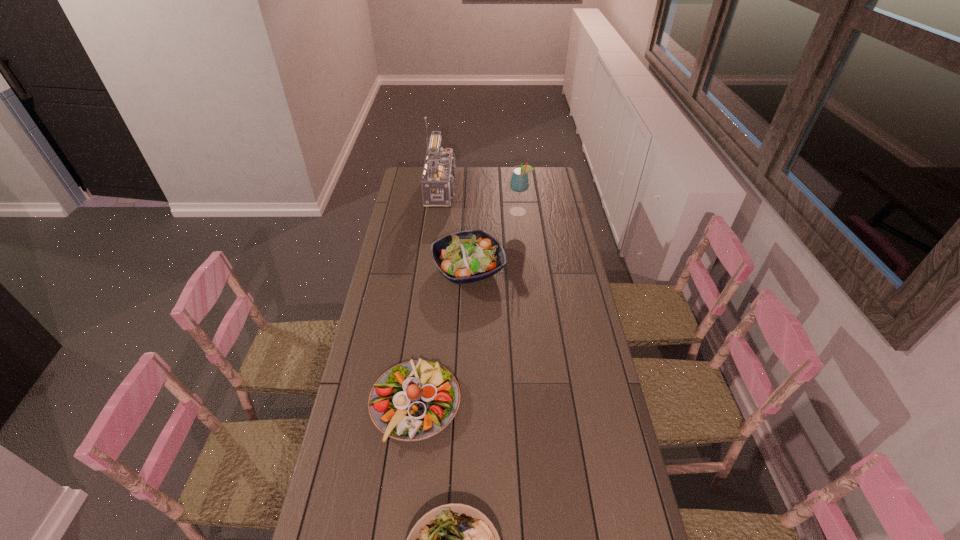
The width and height of the screenshot is (960, 540). In order to click on free spot that satisfies the following two spatial constraints: 1. on the front-facing side of the radio receiver; 2. on the left side of the fourth shortest object in this screenshot , I will do `click(444, 212)`.

Find the location of a particular element. This screenshot has width=960, height=540. blank area in the image that satisfies the following two spatial constraints: 1. on the back side of the second nearest object; 2. on the right side of the third farthest object is located at coordinates (431, 269).

Locate an element on the screen. This screenshot has height=540, width=960. free space that satisfies the following two spatial constraints: 1. on the front-facing side of the alcohol; 2. on the left side of the radio receiver is located at coordinates (444, 212).

Identify the location of free location that satisfies the following two spatial constraints: 1. on the front-facing side of the radio receiver; 2. on the left side of the rightmost object. (444, 212).

You are a GUI agent. You are given a task and a screenshot of the screen. Output one action in this format:
    pyautogui.click(x=<x>, y=<y>)
    Task: Click on the free region that satisfies the following two spatial constraints: 1. on the back side of the tallest salad plate; 2. on the left side of the second shortest salad plate
    This screenshot has width=960, height=540.
    Given the screenshot: What is the action you would take?
    pyautogui.click(x=431, y=269)